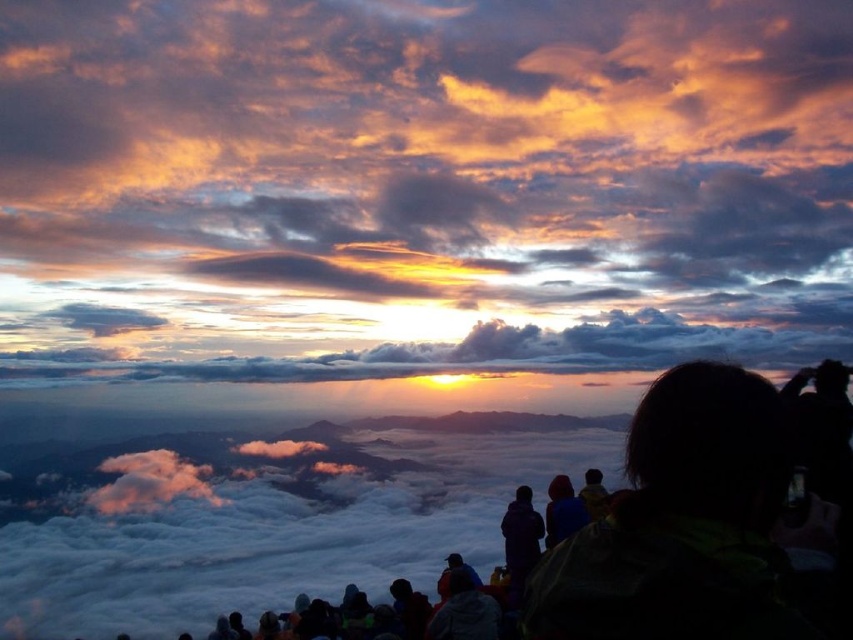
Is blue fabric jacket at center wider than dark blue jacket at center?

Correct, the width of blue fabric jacket at center exceeds that of dark blue jacket at center.

Does blue fabric jacket at center have a lesser height compared to dark blue jacket at center?

No, blue fabric jacket at center is not shorter than dark blue jacket at center.

Does point (558, 536) come in front of point (583, 497)?

Yes.

Image resolution: width=853 pixels, height=640 pixels. Identify the location of blue fabric jacket at center. (561, 512).

Which is below, cloudy sky at upper center or dark blue jacket at center?

Positioned lower is dark blue jacket at center.

Who is more distant from viewer, (28, 193) or (606, 508)?

Point (28, 193)

At what (x,y) coordinates should I click in order to perform the action: click on cloudy sky at upper center. Please return your answer as a coordinate pair (x, y). Looking at the image, I should click on (421, 186).

Is matte purple jacket at center further to camera compared to blue fabric jacket at center?

No, matte purple jacket at center is closer to the viewer.

Who is positioned more to the right, matte purple jacket at center or blue fabric jacket at center?

From the viewer's perspective, blue fabric jacket at center appears more on the right side.

Between point (517, 564) and point (558, 532), which one is positioned in front?

Point (558, 532)

Locate an element on the screen. The width and height of the screenshot is (853, 640). matte purple jacket at center is located at coordinates (521, 536).